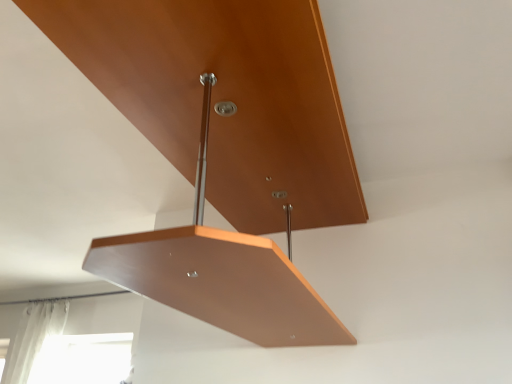
Question: Is point (31, 327) closer or farther from the camera than point (253, 152)?

Choices:
 (A) closer
 (B) farther

Answer: (B)

Question: Considering the positions of white sheer curtain at lower left and matte wood shelf at center in the image, is white sheer curtain at lower left wider or thinner than matte wood shelf at center?

Choices:
 (A) wide
 (B) thin

Answer: (B)

Question: In terms of height, does white sheer curtain at lower left look taller or shorter compared to matte wood shelf at center?

Choices:
 (A) short
 (B) tall

Answer: (B)

Question: From a real-world perspective, relative to white sheer curtain at lower left, is matte wood shelf at center vertically above or below?

Choices:
 (A) below
 (B) above

Answer: (B)

Question: From their relative heights in the image, would you say matte wood shelf at center is taller or shorter than white sheer curtain at lower left?

Choices:
 (A) short
 (B) tall

Answer: (A)

Question: Is point (142, 6) closer or farther from the camera than point (33, 306)?

Choices:
 (A) closer
 (B) farther

Answer: (A)

Question: Choose the correct answer: Is matte wood shelf at center inside white sheer curtain at lower left or outside it?

Choices:
 (A) inside
 (B) outside

Answer: (B)